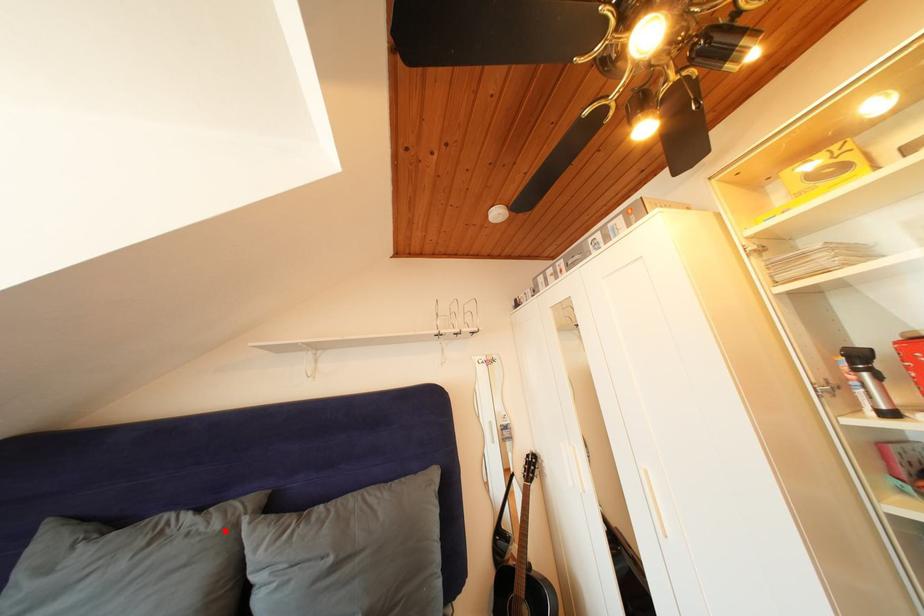
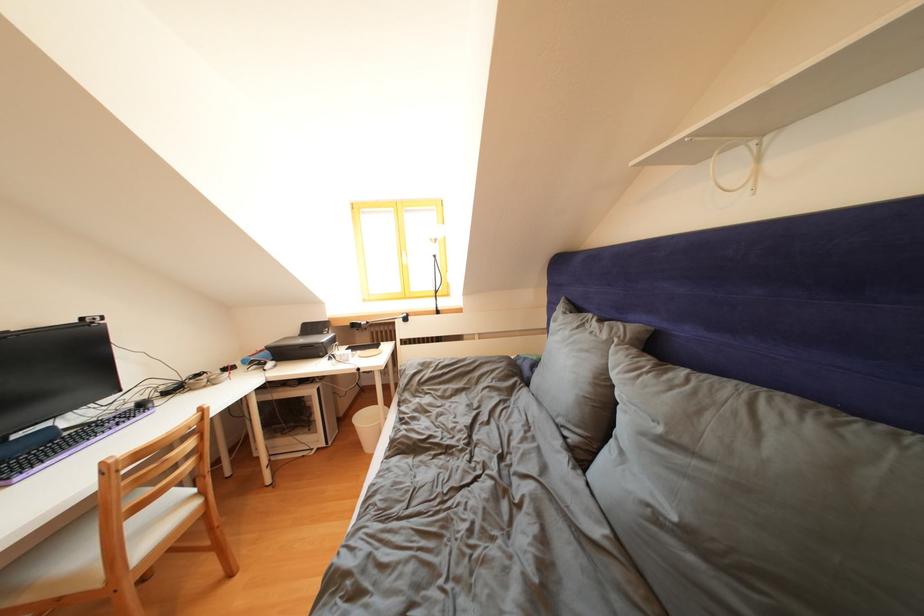
Locate, in the second image, the point that corresponds to the highlighted location in the first image.

(612, 341)